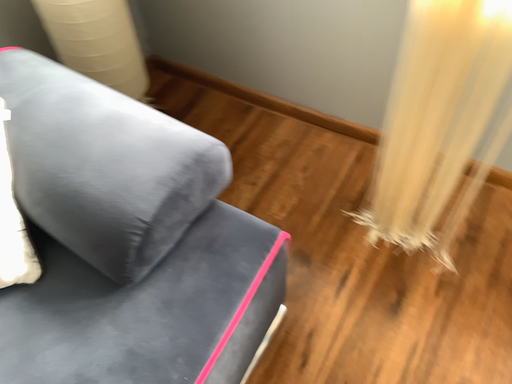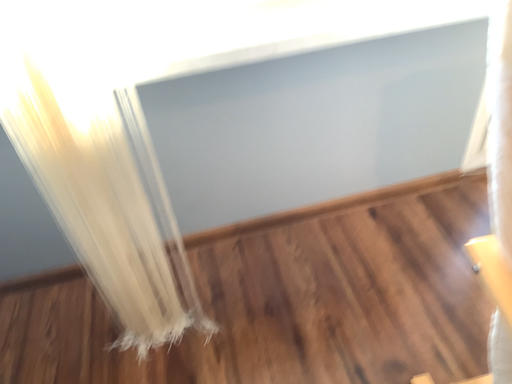
Question: How did the camera likely rotate when shooting the video?

Choices:
 (A) rotated right
 (B) rotated left

Answer: (A)